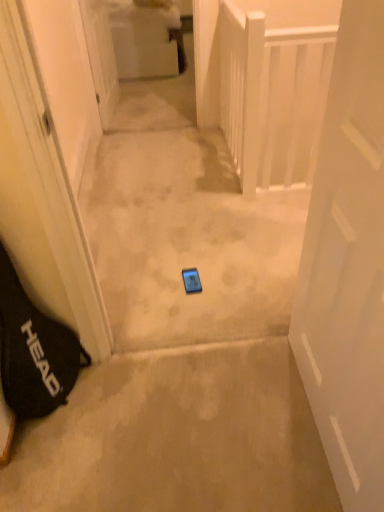
Question: Can you confirm if black fabric bag at left is thinner than white wooden balustrade at upper right?

Choices:
 (A) no
 (B) yes

Answer: (A)

Question: Is black fabric bag at left taller than white wooden balustrade at upper right?

Choices:
 (A) no
 (B) yes

Answer: (A)

Question: Is black fabric bag at left to the left of white wooden balustrade at upper right from the viewer's perspective?

Choices:
 (A) yes
 (B) no

Answer: (A)

Question: From the image's perspective, is black fabric bag at left beneath white wooden balustrade at upper right?

Choices:
 (A) yes
 (B) no

Answer: (A)

Question: Does black fabric bag at left have a lesser height compared to white wooden balustrade at upper right?

Choices:
 (A) yes
 (B) no

Answer: (A)

Question: Is blue glossy phone at center to the left or to the right of white glossy door at upper center, which is counted as the 1th door, starting from the left, in the image?

Choices:
 (A) right
 (B) left

Answer: (A)

Question: In the image, is blue glossy phone at center positioned in front of or behind white glossy door at upper center, which is the 2th door from bottom to top?

Choices:
 (A) behind
 (B) front

Answer: (B)

Question: Based on their sizes in the image, would you say blue glossy phone at center is bigger or smaller than white glossy door at upper center, the second door from the right?

Choices:
 (A) small
 (B) big

Answer: (B)

Question: Does point (109, 206) appear closer or farther from the camera than point (92, 34)?

Choices:
 (A) closer
 (B) farther

Answer: (A)

Question: From the image's perspective, is black fabric bag at left above or below white wooden balustrade at upper right?

Choices:
 (A) below
 (B) above

Answer: (A)

Question: In terms of size, does black fabric bag at left appear bigger or smaller than white wooden balustrade at upper right?

Choices:
 (A) big
 (B) small

Answer: (A)

Question: From a real-world perspective, is black fabric bag at left positioned above or below white wooden balustrade at upper right?

Choices:
 (A) above
 (B) below

Answer: (B)

Question: Does point (28, 397) appear closer or farther from the camera than point (279, 161)?

Choices:
 (A) farther
 (B) closer

Answer: (B)

Question: Considering the positions of beige carpet at center and white wooden balustrade at upper right in the image, is beige carpet at center wider or thinner than white wooden balustrade at upper right?

Choices:
 (A) thin
 (B) wide

Answer: (B)

Question: From a real-world perspective, is beige carpet at center physically located above or below white wooden balustrade at upper right?

Choices:
 (A) above
 (B) below

Answer: (B)